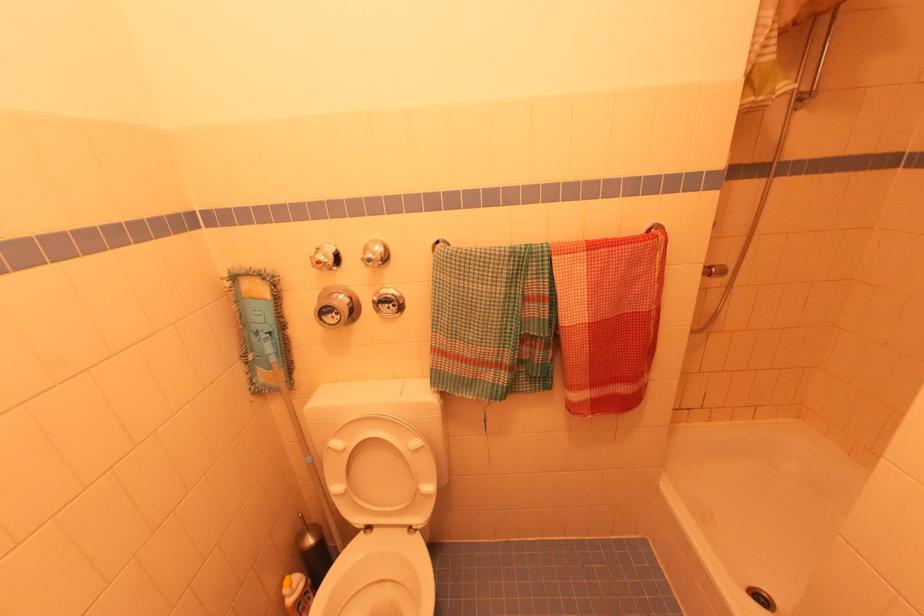
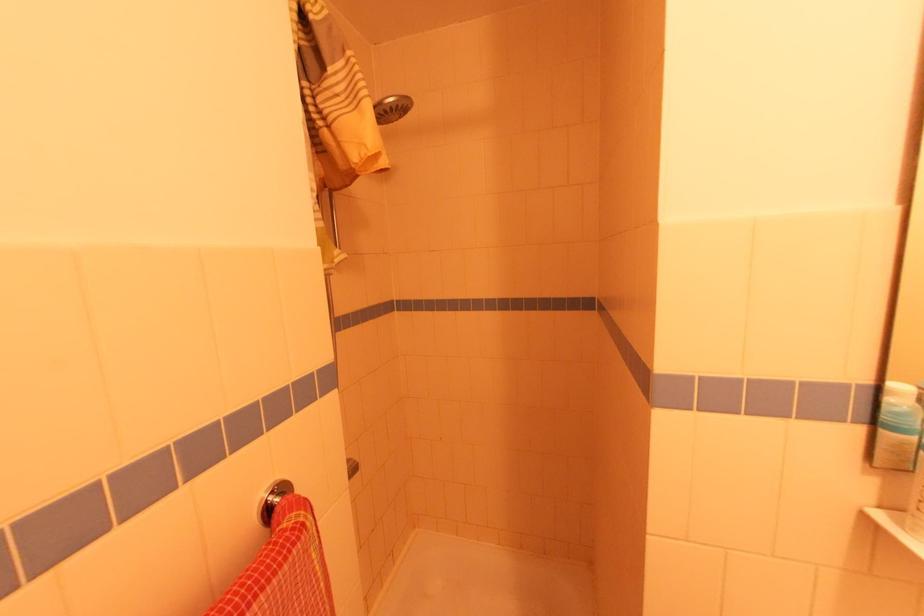
Question: The camera is either moving clockwise (left) or counter-clockwise (right) around the object. The first image is from the beginning of the video and the second image is from the end. Is the camera moving left or right when shooting the video?

Choices:
 (A) Left
 (B) Right

Answer: (A)